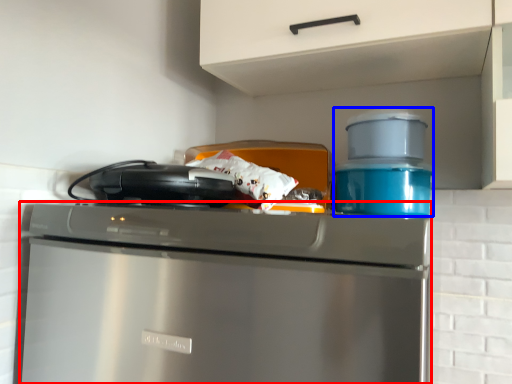
Question: Which of the following is the closest to the observer, home appliance (highlighted by a red box) or appliance (highlighted by a blue box)?

Choices:
 (A) home appliance
 (B) appliance

Answer: (A)